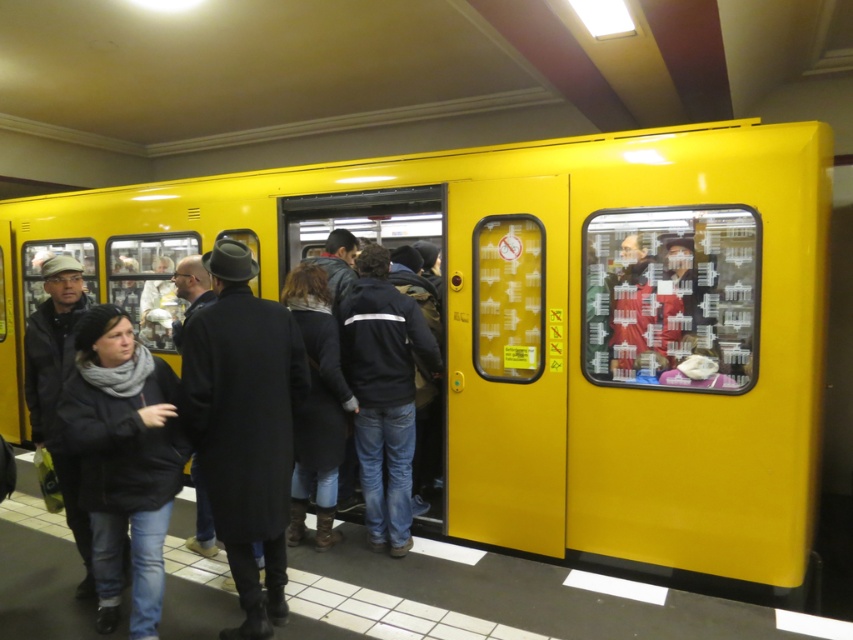
Is metallic yellow train at center to the right of black matte coat at lower left from the viewer's perspective?

Yes, metallic yellow train at center is to the right of black matte coat at lower left.

Does metallic yellow train at center have a lesser height compared to black matte coat at lower left?

No.

Does point (793, 356) come behind point (158, 481)?

Yes, point (793, 356) is farther from viewer.

Image resolution: width=853 pixels, height=640 pixels. I want to click on metallic yellow train at center, so click(544, 323).

Which is behind, point (144, 378) or point (56, 266)?

Positioned behind is point (56, 266).

Who is taller, black matte coat at lower left or dark gray fabric coat at left?

dark gray fabric coat at left is taller.

Between point (120, 387) and point (78, 532), which one is positioned in front?

Positioned in front is point (120, 387).

Find the location of a particular element. The height and width of the screenshot is (640, 853). black matte coat at lower left is located at coordinates (123, 460).

Which of these two, black matte jacket at center or dark gray fabric coat at left, stands shorter?

dark gray fabric coat at left is shorter.

Which is above, black matte jacket at center or dark gray fabric coat at left?

black matte jacket at center

Which is in front, point (387, 472) or point (35, 372)?

Point (35, 372) is more forward.

You are a GUI agent. You are given a task and a screenshot of the screen. Output one action in this format:
    pyautogui.click(x=<x>, y=<y>)
    Task: Click on the black matte jacket at center
    The width and height of the screenshot is (853, 640).
    Given the screenshot: What is the action you would take?
    pyautogui.click(x=383, y=392)